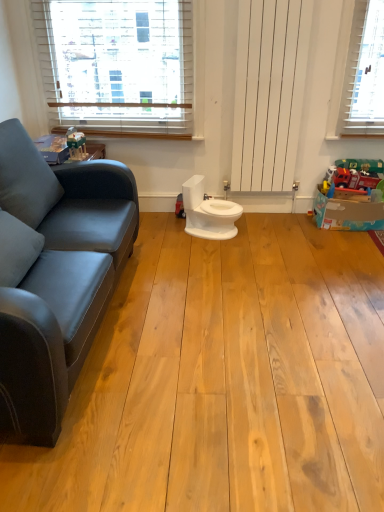
How much space does matte red fire truck at right, placed as the first toy when sorted from back to front, occupy vertically?

17.18 inches.

Identify the location of white glossy toilet at center. This screenshot has width=384, height=512. (208, 212).

Are white glossy toilet at center and matte plastic toy at upper left, which appears as the 2th toy when viewed from the right, far apart?

No, there isn't a large distance between white glossy toilet at center and matte plastic toy at upper left, which appears as the 2th toy when viewed from the right.

How different are the orientations of white glossy toilet at center and matte plastic toy at upper left, which appears as the 2th toy when viewed from the right, in degrees?

The angular difference between white glossy toilet at center and matte plastic toy at upper left, which appears as the 2th toy when viewed from the right, is 23.4 degrees.

Considering the sizes of objects white glossy toilet at center and matte plastic toy at upper left, which is counted as the 2th toy, starting from the back, in the image provided, who is bigger, white glossy toilet at center or matte plastic toy at upper left, which is counted as the 2th toy, starting from the back,?

Bigger between the two is white glossy toilet at center.

Between point (195, 234) and point (81, 150), which one is positioned in front?

The point (81, 150) is closer to the camera.

Is matte red fire truck at right, arranged as the 1th toy when viewed from the right, completely or partially inside white glossy toilet at center?

No, matte red fire truck at right, arranged as the 1th toy when viewed from the right, is not surrounded by white glossy toilet at center.

From a real-world perspective, between white glossy toilet at center and matte red fire truck at right, arranged as the 2th toy when viewed from the front, who is vertically lower?

white glossy toilet at center is physically lower.

Can you confirm if white glossy toilet at center is thinner than matte red fire truck at right, arranged as the 1th toy when viewed from the right?

No, white glossy toilet at center is not thinner than matte red fire truck at right, arranged as the 1th toy when viewed from the right.

Is point (189, 198) behind point (361, 221)?

Yes, it is behind point (361, 221).

Is white glossy toilet at center thinner than white wooden blinds at upper left?

No, white glossy toilet at center is not thinner than white wooden blinds at upper left.

Is white glossy toilet at center directly adjacent to white wooden blinds at upper left?

There is a gap between white glossy toilet at center and white wooden blinds at upper left.

Looking at this image, considering the positions of objects white glossy toilet at center and white wooden blinds at upper left in the image provided, who is in front, white glossy toilet at center or white wooden blinds at upper left?

white glossy toilet at center is more forward.

Could you tell me if white glossy toilet at center is facing white wooden blinds at upper left?

No, white glossy toilet at center is not facing towards white wooden blinds at upper left.

Who is taller, white wooden blinds at upper left or matte plastic toy at upper left, which is counted as the 1th toy, starting from the left?

white wooden blinds at upper left.

Is white wooden blinds at upper left placed right next to matte plastic toy at upper left, which appears as the 2th toy when viewed from the right?

They are not placed beside each other.

Does white wooden blinds at upper left have a smaller size compared to matte plastic toy at upper left, which appears as the 2th toy when viewed from the right?

Actually, white wooden blinds at upper left might be larger than matte plastic toy at upper left, which appears as the 2th toy when viewed from the right.

From the image's perspective, which one is positioned higher, matte plastic toy at upper left, arranged as the first toy when viewed from the front, or matte red fire truck at right, arranged as the 1th toy when viewed from the right?

From the image's view, matte plastic toy at upper left, arranged as the first toy when viewed from the front, is above.

Is matte plastic toy at upper left, arranged as the first toy when viewed from the front, inside or outside of matte red fire truck at right, arranged as the 2th toy when viewed from the front?

matte plastic toy at upper left, arranged as the first toy when viewed from the front, is outside matte red fire truck at right, arranged as the 2th toy when viewed from the front.

Based on the photo, in terms of size, does matte plastic toy at upper left, which is counted as the 2th toy, starting from the back, appear bigger or smaller than matte red fire truck at right, arranged as the 1th toy when viewed from the right?

Clearly, matte plastic toy at upper left, which is counted as the 2th toy, starting from the back, is smaller in size than matte red fire truck at right, arranged as the 1th toy when viewed from the right.

How distant is matte plastic toy at upper left, arranged as the first toy when viewed from the front, from matte red fire truck at right, acting as the second toy starting from the left?

matte plastic toy at upper left, arranged as the first toy when viewed from the front, is 5.79 feet away from matte red fire truck at right, acting as the second toy starting from the left.

Is white wooden blinds at upper left far away from matte red fire truck at right, placed as the first toy when sorted from back to front?

Yes, white wooden blinds at upper left is far from matte red fire truck at right, placed as the first toy when sorted from back to front.

Find the location of a particular element. the 2nd toy positioned below the white wooden blinds at upper left (from a real-world perspective) is located at coordinates (351, 196).

In terms of width, does white wooden blinds at upper left look wider or thinner when compared to matte red fire truck at right, arranged as the 2th toy when viewed from the front?

In the image, white wooden blinds at upper left appears to be more narrow than matte red fire truck at right, arranged as the 2th toy when viewed from the front.

Which is behind, point (81, 32) or point (216, 204)?

The point (216, 204) is farther from the camera.

Is white wooden blinds at upper left positioned far away from white glossy toilet at center?

No, there isn't a large distance between white wooden blinds at upper left and white glossy toilet at center.

Looking at this image, looking at their sizes, would you say white wooden blinds at upper left is wider or thinner than white glossy toilet at center?

Clearly, white wooden blinds at upper left has less width compared to white glossy toilet at center.

There is a white glossy toilet at center. In order to click on the 2nd toy above it (from a real-world perspective) in this screenshot , I will do `click(76, 145)`.

Locate an element on the screen. The width and height of the screenshot is (384, 512). toilet located in front of the matte red fire truck at right, arranged as the 2th toy when viewed from the front is located at coordinates (208, 212).

Which object lies nearer to the anchor point matte plastic toy at upper left, which is counted as the 1th toy, starting from the left, matte red fire truck at right, arranged as the 2th toy when viewed from the front, or white wooden blinds at upper left?

white wooden blinds at upper left.

When comparing their distances from white glossy toilet at center, does matte red fire truck at right, arranged as the 2th toy when viewed from the front, or matte plastic toy at upper left, which is counted as the 2th toy, starting from the back, seem closer?

The object closer to white glossy toilet at center is matte red fire truck at right, arranged as the 2th toy when viewed from the front.

Which object lies further to the anchor point matte plastic toy at upper left, which appears as the 2th toy when viewed from the right, white wooden blinds at upper left or matte red fire truck at right, arranged as the 2th toy when viewed from the front?

matte red fire truck at right, arranged as the 2th toy when viewed from the front, is positioned further to the anchor matte plastic toy at upper left, which appears as the 2th toy when viewed from the right.

Looking at the image, which one is located closer to white glossy toilet at center, matte plastic toy at upper left, which is counted as the 2th toy, starting from the back, or matte red fire truck at right, acting as the second toy starting from the left?

matte red fire truck at right, acting as the second toy starting from the left.

Estimate the real-world distances between objects in this image. Which object is closer to white wooden blinds at upper left, matte red fire truck at right, arranged as the 1th toy when viewed from the right, or white glossy toilet at center?

Based on the image, white glossy toilet at center appears to be nearer to white wooden blinds at upper left.

Based on their spatial positions, is white wooden blinds at upper left or matte red fire truck at right, placed as the first toy when sorted from back to front, further from white glossy toilet at center?

Among the two, white wooden blinds at upper left is located further to white glossy toilet at center.

From the image, which object appears to be farther from white wooden blinds at upper left, matte plastic toy at upper left, which is counted as the 2th toy, starting from the back, or matte red fire truck at right, acting as the second toy starting from the left?

matte red fire truck at right, acting as the second toy starting from the left, lies further to white wooden blinds at upper left than the other object.

Which object lies further to the anchor point matte plastic toy at upper left, which appears as the 2th toy when viewed from the right, matte red fire truck at right, arranged as the 2th toy when viewed from the front, or white glossy toilet at center?

matte red fire truck at right, arranged as the 2th toy when viewed from the front, is positioned further to the anchor matte plastic toy at upper left, which appears as the 2th toy when viewed from the right.

I want to click on window between matte plastic toy at upper left, which appears as the 2th toy when viewed from the right, and matte red fire truck at right, acting as the second toy starting from the left, in the horizontal direction, so click(x=118, y=65).

Where is `toilet between matte plastic toy at upper left, which is counted as the 1th toy, starting from the left, and matte red fire truck at right, placed as the first toy when sorted from back to front`? toilet between matte plastic toy at upper left, which is counted as the 1th toy, starting from the left, and matte red fire truck at right, placed as the first toy when sorted from back to front is located at coordinates (208, 212).

Where is `toilet located between white wooden blinds at upper left and matte red fire truck at right, arranged as the 2th toy when viewed from the front, in the left-right direction`? The width and height of the screenshot is (384, 512). toilet located between white wooden blinds at upper left and matte red fire truck at right, arranged as the 2th toy when viewed from the front, in the left-right direction is located at coordinates (208, 212).